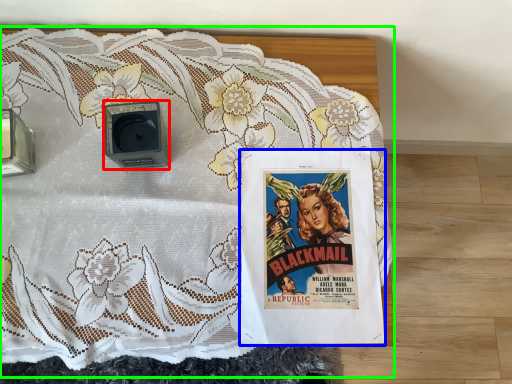
Question: Which object is the closest to the alarm (highlighted by a red box)? Choose among these: poster (highlighted by a blue box) or bed (highlighted by a green box).

Choices:
 (A) poster
 (B) bed

Answer: (B)